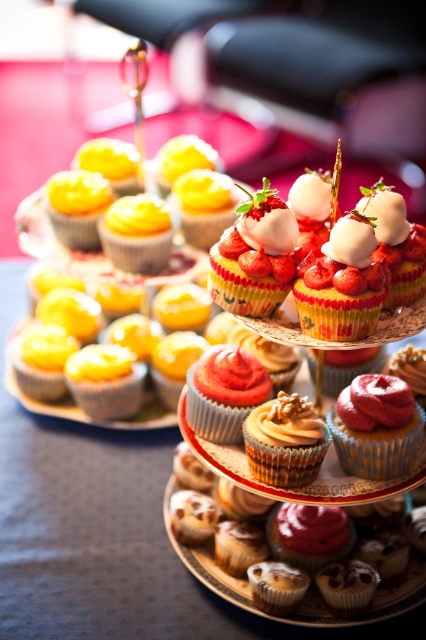
From the picture: You are a baker inspecting the cupcakes on the multi tiered stand. You need to locate the glazed brown muffin at center. According to the coordinates given, where exactly is it positioned?

The glazed brown muffin at center is located at point (276, 586).

You are a customer at a bakery and see the smooth pink frosting cupcake at center and the yellow matte cupcake at upper left. Which one is located more to the left?

The yellow matte cupcake at upper left is more to the left than the smooth pink frosting cupcake at center.